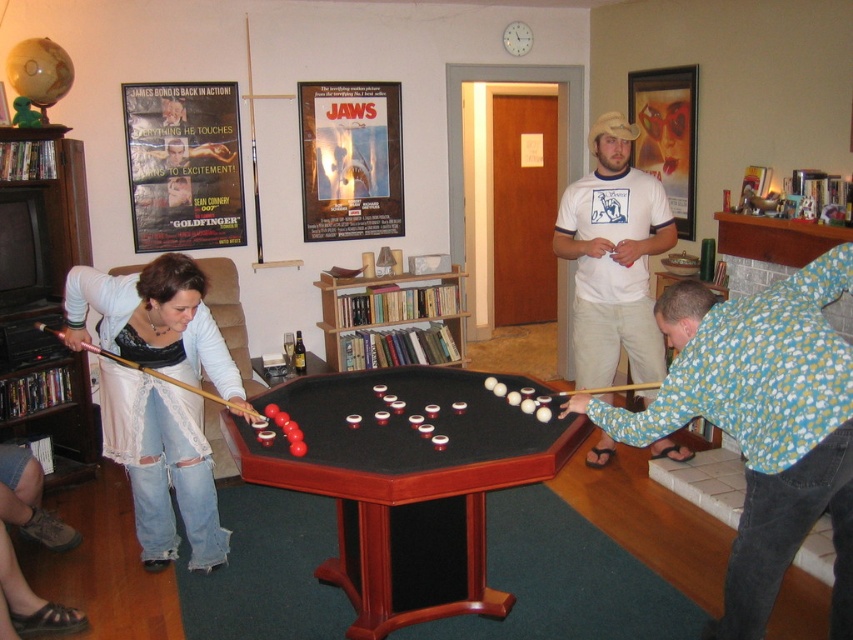
Is mahogany wood billiard table at center smaller than wooden cue at left?

Incorrect, mahogany wood billiard table at center is not smaller in size than wooden cue at left.

Which is above, mahogany wood billiard table at center or wooden cue at left?

wooden cue at left

Locate an element on the screen. Image resolution: width=853 pixels, height=640 pixels. mahogany wood billiard table at center is located at coordinates (405, 483).

Does point (109, 445) come in front of point (42, 330)?

Yes, point (109, 445) is closer to viewer.

How distant is matte white shirt at left from wooden cue at left?

matte white shirt at left and wooden cue at left are 8.64 inches apart from each other.

Is point (190, 288) more distant than point (155, 376)?

That is False.

The height and width of the screenshot is (640, 853). Find the location of `matte white shirt at left`. matte white shirt at left is located at coordinates (161, 465).

Is mahogany wood billiard table at center thinner than floral shirt at center?

Incorrect, mahogany wood billiard table at center's width is not less than floral shirt at center's.

Between mahogany wood billiard table at center and floral shirt at center, which one appears on the left side from the viewer's perspective?

Positioned to the left is mahogany wood billiard table at center.

Between point (384, 428) and point (770, 477), which one is positioned behind?

The point (384, 428) is more distant.

What are the coordinates of `mahogany wood billiard table at center` in the screenshot? It's located at (405, 483).